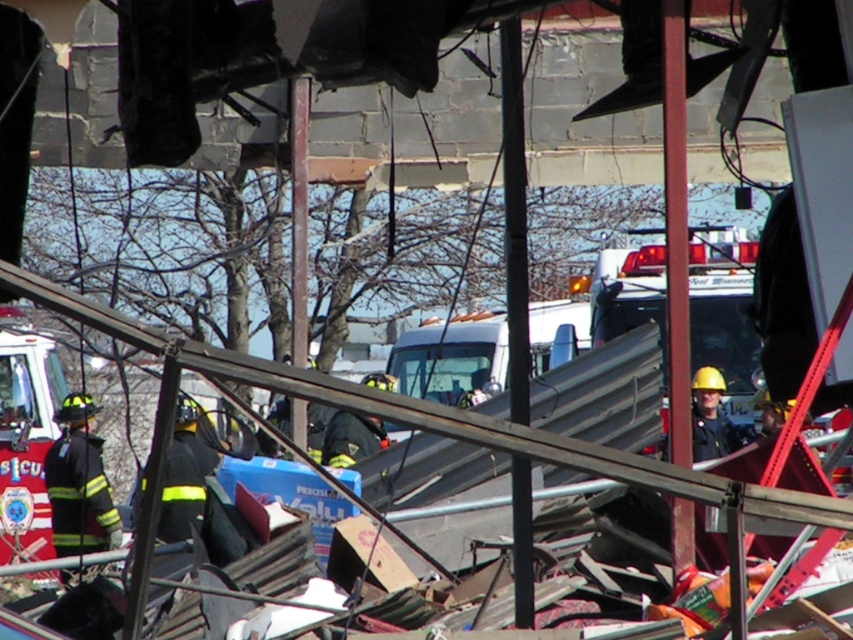
Can you confirm if red glossy fire truck at lower left is wider than black uniformed firefighter at left?

Yes.

Which is below, red glossy fire truck at lower left or black uniformed firefighter at left?

black uniformed firefighter at left is lower down.

Does point (12, 422) come in front of point (94, 515)?

No, (12, 422) is behind (94, 515).

This screenshot has width=853, height=640. I want to click on red glossy fire truck at lower left, so click(x=25, y=436).